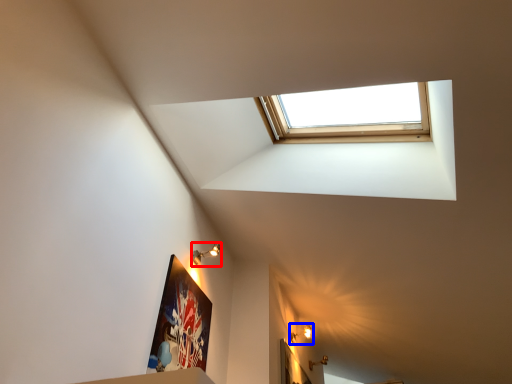
Question: Which object appears closest to the camera in this image, light fixture (highlighted by a red box) or light fixture (highlighted by a blue box)?

Choices:
 (A) light fixture
 (B) light fixture

Answer: (A)